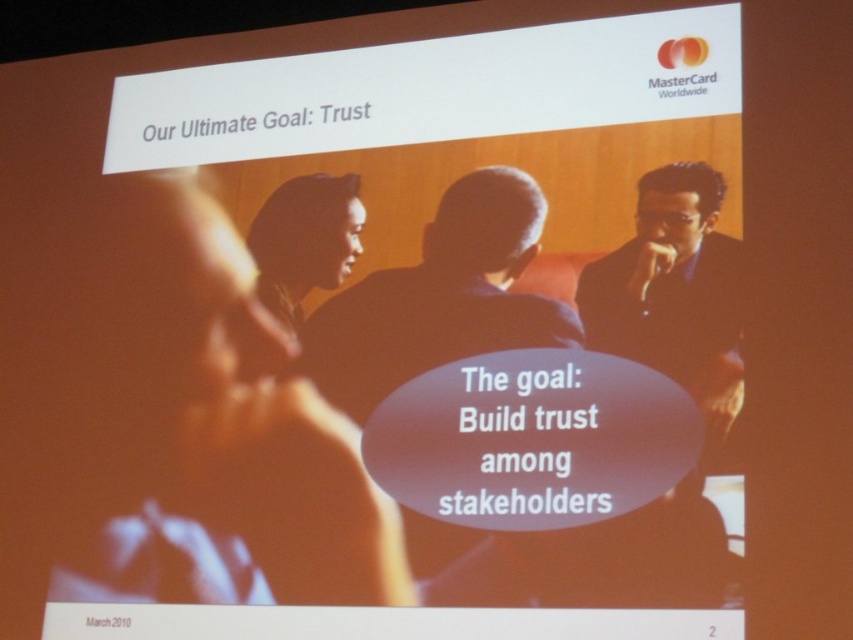
Is dark blue suit at center closer to camera compared to black glossy suit at right?

No, it is not.

Can you confirm if dark blue suit at center is positioned below black glossy suit at right?

Yes.

Is point (463, 296) more distant than point (672, 182)?

Yes, point (463, 296) is behind point (672, 182).

Where is `dark blue suit at center`? The image size is (853, 640). dark blue suit at center is located at coordinates (440, 298).

How far apart are black glossy suit at right and dark skin smooth face at center?

A distance of 86.15 centimeters exists between black glossy suit at right and dark skin smooth face at center.

Is black glossy suit at right smaller than dark skin smooth face at center?

Incorrect, black glossy suit at right is not smaller in size than dark skin smooth face at center.

What do you see at coordinates (674, 292) in the screenshot? I see `black glossy suit at right` at bounding box center [674, 292].

Locate an element on the screen. This screenshot has height=640, width=853. black glossy suit at right is located at coordinates (674, 292).

Does smooth skin face at center appear on the right side of dark blue suit at center?

No, smooth skin face at center is not to the right of dark blue suit at center.

Can you confirm if smooth skin face at center is shorter than dark blue suit at center?

No, smooth skin face at center is not shorter than dark blue suit at center.

The height and width of the screenshot is (640, 853). Find the location of `smooth skin face at center`. smooth skin face at center is located at coordinates (242, 451).

You are a GUI agent. You are given a task and a screenshot of the screen. Output one action in this format:
    pyautogui.click(x=<x>, y=<y>)
    Task: Click on the smooth skin face at center
    The height and width of the screenshot is (640, 853).
    Given the screenshot: What is the action you would take?
    pyautogui.click(x=242, y=451)